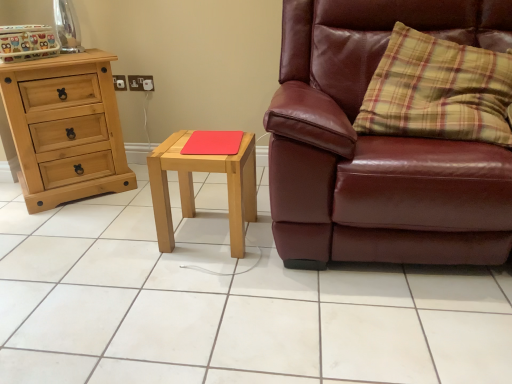
In order to click on free space in front of light wood/matte nightstand at center in this screenshot , I will do `click(204, 279)`.